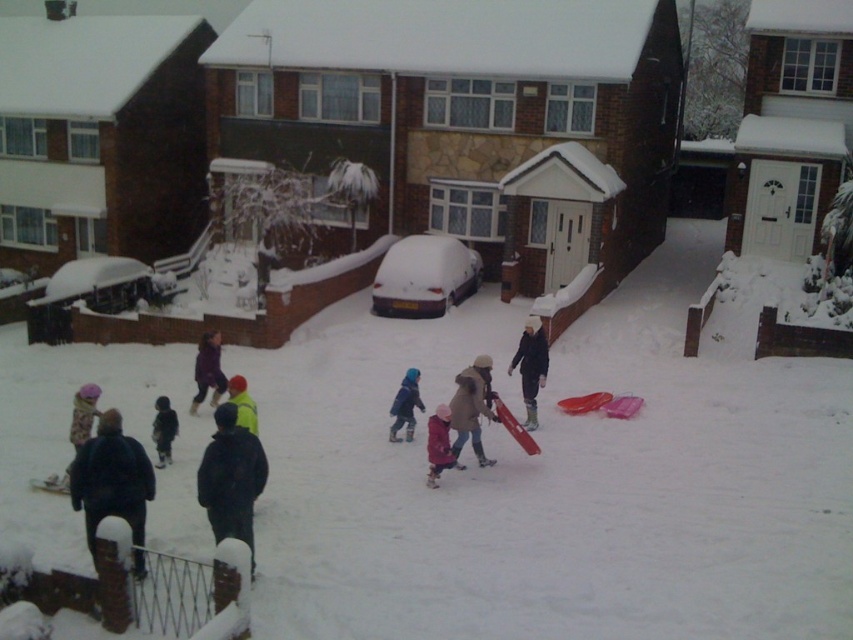
You are trying to decide which item to grab first from the snowy scene. The matte black jacket at center and the blue woolen hat at center are both in your reach. Which one is wider?

The blue woolen hat at center is wider than the matte black jacket at center because the matte black jacket at center has a smaller width.

You are a photographer standing at the edge of the snowy area. You want to take a photo that includes both the black matte jacket at lower center and the fluffy pink hat at center. Given that your camera has a maximum focus range of 10 feet, will you be able to capture both subjects in focus without moving your position?

The distance between the black matte jacket at lower center and the fluffy pink hat at center is 13.92 feet, which exceeds the camera maximum focus range of 10 feet. Therefore, you cannot capture both subjects in focus without moving your position.